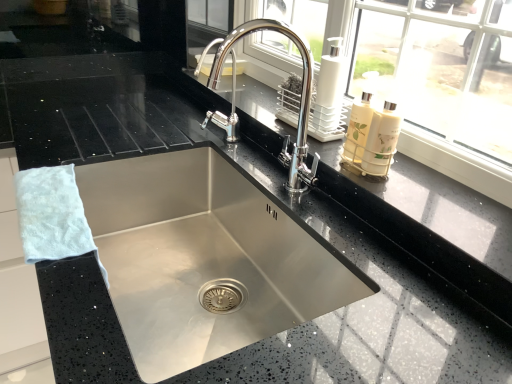
Locate an element on the screen. The width and height of the screenshot is (512, 384). free space above white fluffy hand towel at left (from a real-world perspective) is located at coordinates (56, 197).